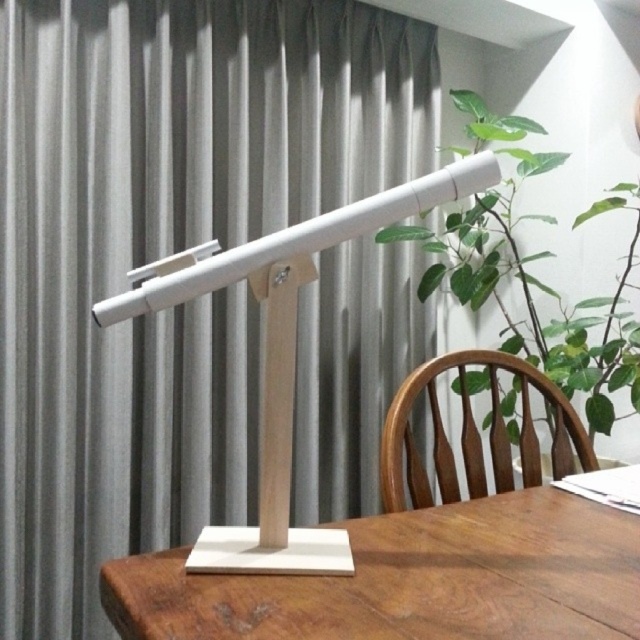
Is point (328, 410) less distant than point (212, 614)?

No, (328, 410) is further to viewer.

Is matte gray curtain at upper center smaller than wooden table at center?

No.

Which is behind, point (28, 214) or point (636, 580)?

The point (28, 214) is more distant.

Find the location of a particular element. matte gray curtain at upper center is located at coordinates (163, 253).

Which is behind, point (593, 422) or point (552, 442)?

The point (593, 422) is more distant.

How far apart are green leafy plant at center and brown wooden chair at center?

green leafy plant at center is 38.36 inches away from brown wooden chair at center.

Between point (502, 256) and point (460, 364), which one is positioned behind?

Positioned behind is point (502, 256).

This screenshot has width=640, height=640. What are the coordinates of `green leafy plant at center` in the screenshot? It's located at (532, 275).

Between matte gray curtain at upper center and green leafy plant at center, which one has more height?

With more height is matte gray curtain at upper center.

Is point (195, 368) closer to viewer compared to point (496, 144)?

Yes.

What do you see at coordinates (163, 253) in the screenshot? I see `matte gray curtain at upper center` at bounding box center [163, 253].

I want to click on matte gray curtain at upper center, so click(x=163, y=253).